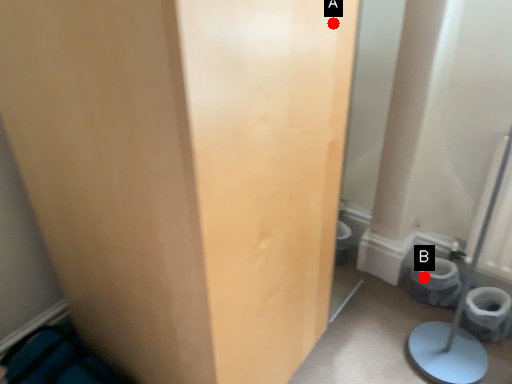
Question: Two points are circled on the image, labeled by A and B beside each circle. Which point is further to the camera?

Choices:
 (A) A is further
 (B) B is further

Answer: (B)